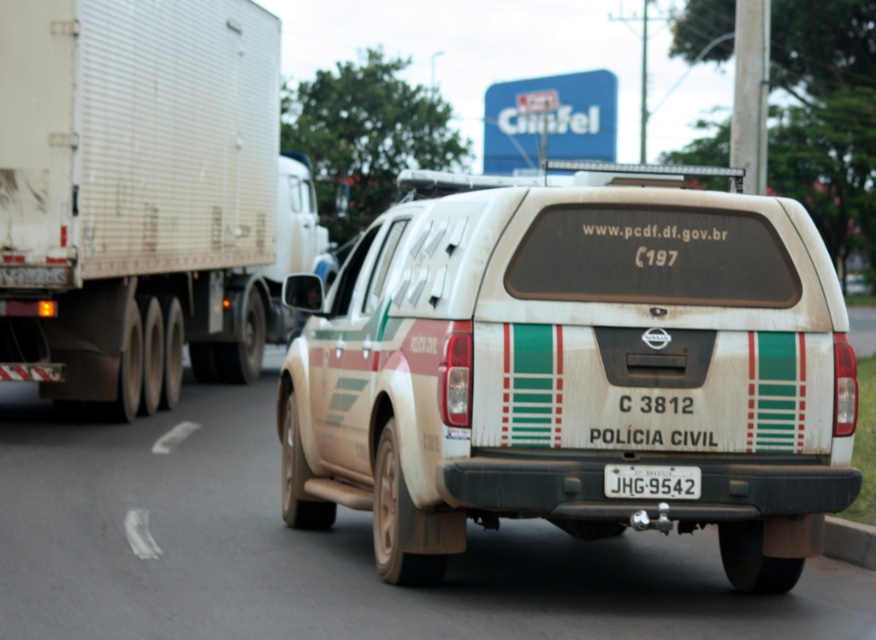
You are a pedestrian standing on the road and see the white corrugated metal trailer truck at left and the matte white truck at left. Which one is higher from the ground?

The white corrugated metal trailer truck at left is located above the matte white truck at left, so it is higher from the ground.

You are a GPS system guiding a driver to a destination. The driver is currently at a location with coordinates 0.581, 0.655. The destination is at coordinates 0.6, 0.6. Is the matte beige pickup truck at center located at the driver current position?

The matte beige pickup truck at center is located at point [573,371], which matches the driver current position coordinates. Therefore, the matte beige pickup truck at center is indeed at the driver current position.